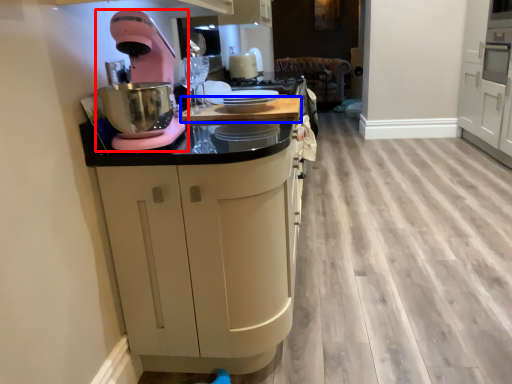
Question: Which of the following is the farthest to the observer, home appliance (highlighted by a red box) or counter top (highlighted by a blue box)?

Choices:
 (A) home appliance
 (B) counter top

Answer: (B)